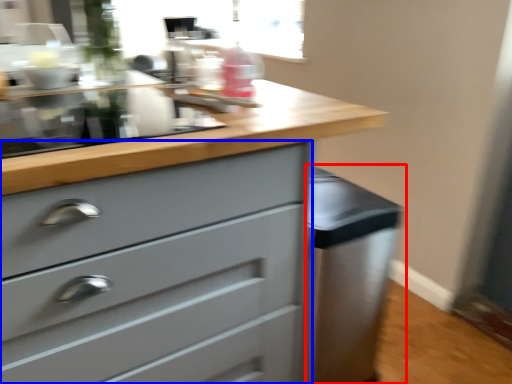
Question: Which object is closer to the camera taking this photo, cabinetry (highlighted by a red box) or chest of drawers (highlighted by a blue box)?

Choices:
 (A) cabinetry
 (B) chest of drawers

Answer: (B)